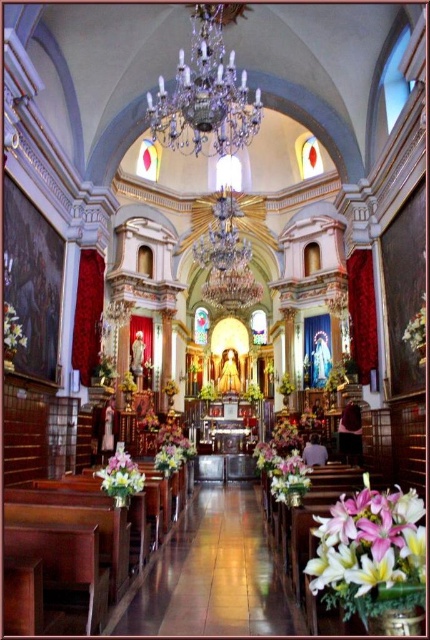
Locate an element on the screen. Image resolution: width=430 pixels, height=640 pixels. crystal glass chandelier at upper center is located at coordinates (205, 92).

Which is in front, point (181, 64) or point (11, 333)?

Point (11, 333) is more forward.

I want to click on crystal glass chandelier at upper center, so click(205, 92).

Locate an element on the screen. The image size is (430, 640). crystal glass chandelier at upper center is located at coordinates (205, 92).

Between pastel pink silk flowers at lower left and white matte flower at left, which one appears on the right side from the viewer's perspective?

From the viewer's perspective, pastel pink silk flowers at lower left appears more on the right side.

Can you confirm if pastel pink silk flowers at lower left is taller than white matte flower at left?

Yes, pastel pink silk flowers at lower left is taller than white matte flower at left.

You are a GUI agent. You are given a task and a screenshot of the screen. Output one action in this format:
    pyautogui.click(x=<x>, y=<y>)
    Task: Click on the pastel pink silk flowers at lower left
    The image size is (430, 640).
    Given the screenshot: What is the action you would take?
    pyautogui.click(x=120, y=476)

Where is `pastel pink silk flowers at lower left`? pastel pink silk flowers at lower left is located at coordinates (120, 476).

Does white floral arrangement at center have a greater height compared to white matte flower at left?

Yes, white floral arrangement at center is taller than white matte flower at left.

Between white floral arrangement at center and white matte flower at left, which one appears on the right side from the viewer's perspective?

white floral arrangement at center is more to the right.

Find the location of `white floral arrangement at center`. white floral arrangement at center is located at coordinates (283, 465).

Identify the location of white floral arrangement at center. This screenshot has height=640, width=430. (283, 465).